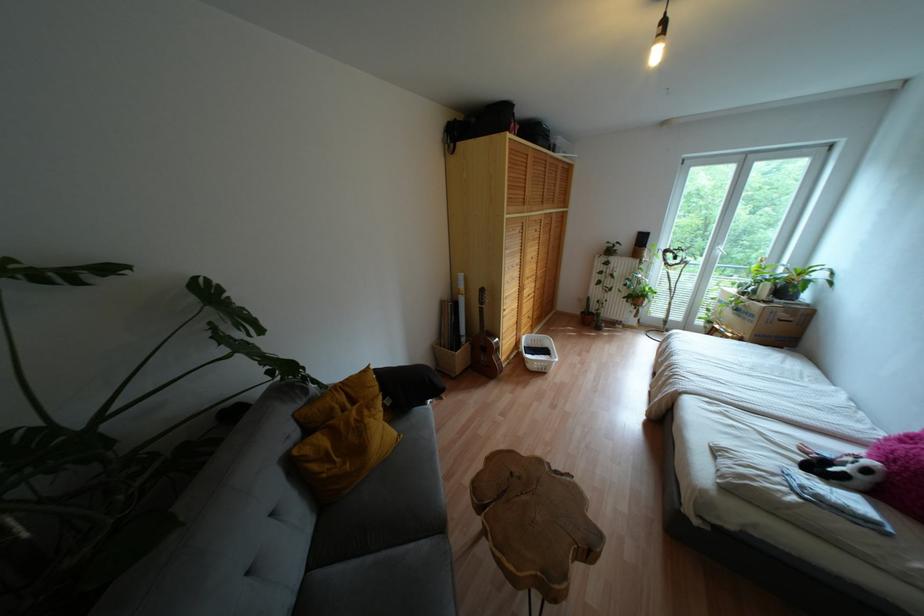
Locate an element on the screen. radiator valve knob is located at coordinates (616, 309).